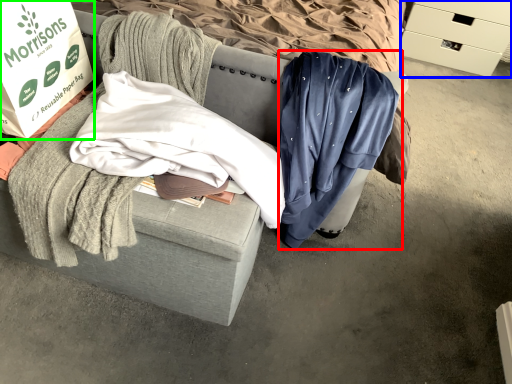
Question: Which object is positioned farthest from clothing (highlighted by a red box)? Select from drawer (highlighted by a blue box) and box (highlighted by a green box).

Choices:
 (A) drawer
 (B) box

Answer: (A)